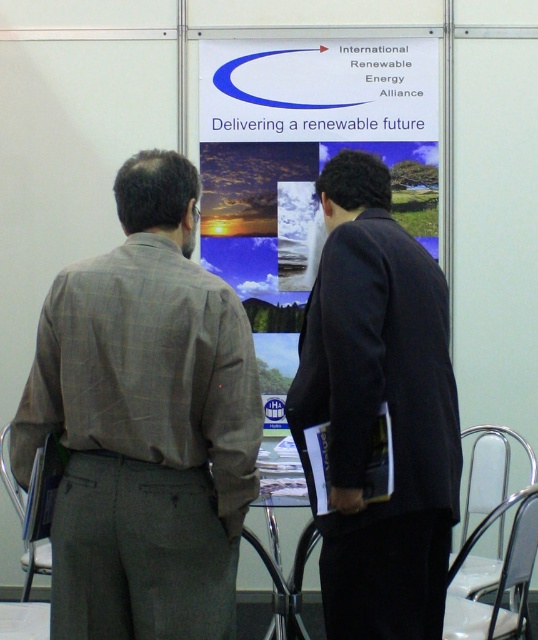
Is black matte suit at center below metallic silver chair at lower left?

Incorrect, black matte suit at center is not positioned below metallic silver chair at lower left.

Who is more distant from viewer, (448,358) or (23,518)?

Positioned behind is point (23,518).

Identify the location of black matte suit at center. The height and width of the screenshot is (640, 538). (378, 410).

Is black matte suit at center further to the viewer compared to white paperboard at center?

That is False.

Is point (412, 589) positioned in front of point (277, 54)?

Yes.

In order to click on black matte suit at center in this screenshot , I will do `click(378, 410)`.

Who is lower down, gray checkered shirt at left or metallic silver chair at lower left?

metallic silver chair at lower left is lower down.

Can you confirm if gray checkered shirt at left is bigger than metallic silver chair at lower left?

No.

Is point (80, 580) in front of point (8, 493)?

Yes, it is in front of point (8, 493).

You are a GUI agent. You are given a task and a screenshot of the screen. Output one action in this format:
    pyautogui.click(x=<x>, y=<y>)
    Task: Click on the gray checkered shirt at left
    This screenshot has height=640, width=538.
    Given the screenshot: What is the action you would take?
    pyautogui.click(x=145, y=422)